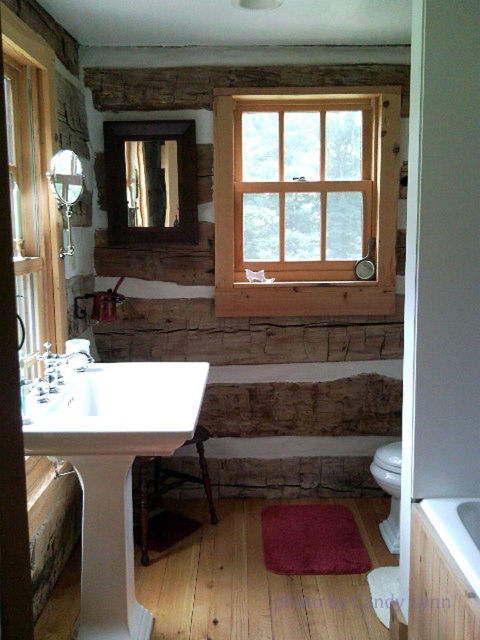
Question: Which object appears farthest from the camera in this image?

Choices:
 (A) wooden stool at lower center
 (B) white glossy porcelain toilet bowl at lower right

Answer: (B)

Question: Among these points, which one is nearest to the camera?

Choices:
 (A) (83, 355)
 (B) (132, 408)

Answer: (B)

Question: Which object is the closest to the white glossy porcelain toilet bowl at lower right?

Choices:
 (A) brushed metal faucet at left
 (B) white glossy bathtub at lower right
 (C) wooden stool at lower center

Answer: (C)

Question: Does white glossy sink at center have a smaller size compared to white glossy porcelain toilet bowl at lower right?

Choices:
 (A) no
 (B) yes

Answer: (A)

Question: Is wooden frame at center positioned before brushed metal faucet at left?

Choices:
 (A) yes
 (B) no

Answer: (B)

Question: Is wooden frame at center bigger than white glossy porcelain toilet bowl at lower right?

Choices:
 (A) yes
 (B) no

Answer: (A)